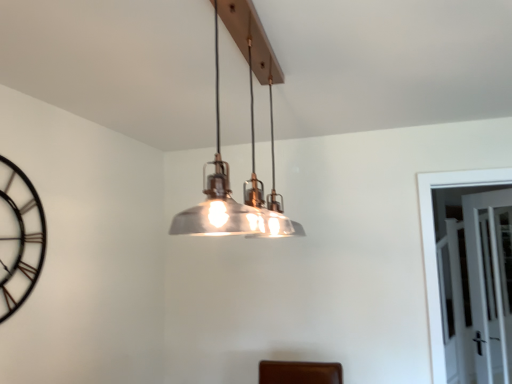
Question: Is clear glass door at right further to the viewer compared to metallic/textured pendant light at center?

Choices:
 (A) no
 (B) yes

Answer: (B)

Question: Does clear glass door at right have a lesser width compared to metallic/textured pendant light at center?

Choices:
 (A) yes
 (B) no

Answer: (A)

Question: Is clear glass door at right looking in the opposite direction of metallic/textured pendant light at center?

Choices:
 (A) no
 (B) yes

Answer: (A)

Question: Does clear glass door at right appear on the right side of metallic/textured pendant light at center?

Choices:
 (A) no
 (B) yes

Answer: (B)

Question: Can you confirm if clear glass door at right is wider than metallic/textured pendant light at center?

Choices:
 (A) yes
 (B) no

Answer: (B)

Question: From the image's perspective, does clear glass door at right appear lower than metallic/textured pendant light at center?

Choices:
 (A) yes
 (B) no

Answer: (A)

Question: Can you confirm if metallic/textured pendant light at center is taller than black metal clock at left?

Choices:
 (A) no
 (B) yes

Answer: (A)

Question: Is metallic/textured pendant light at center next to black metal clock at left?

Choices:
 (A) no
 (B) yes

Answer: (A)

Question: Is metallic/textured pendant light at center looking in the opposite direction of black metal clock at left?

Choices:
 (A) yes
 (B) no

Answer: (A)

Question: Can you confirm if metallic/textured pendant light at center is positioned to the right of black metal clock at left?

Choices:
 (A) no
 (B) yes

Answer: (B)

Question: Does metallic/textured pendant light at center have a greater width compared to black metal clock at left?

Choices:
 (A) yes
 (B) no

Answer: (A)

Question: Can you confirm if metallic/textured pendant light at center is smaller than black metal clock at left?

Choices:
 (A) yes
 (B) no

Answer: (B)

Question: Is black metal clock at left at the left side of metallic/textured pendant light at center?

Choices:
 (A) yes
 (B) no

Answer: (A)